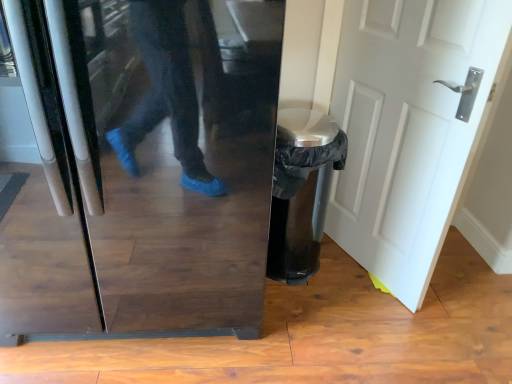
Question: Is white matte door at center taller or shorter than glossy black refrigerator at center?

Choices:
 (A) tall
 (B) short

Answer: (A)

Question: Is point (443, 220) positioned closer to the camera than point (78, 82)?

Choices:
 (A) farther
 (B) closer

Answer: (A)

Question: Considering the positions of white matte door at center and glossy black refrigerator at center in the image, is white matte door at center wider or thinner than glossy black refrigerator at center?

Choices:
 (A) wide
 (B) thin

Answer: (B)

Question: From a real-world perspective, is glossy black refrigerator at center above or below white matte door at center?

Choices:
 (A) above
 (B) below

Answer: (A)

Question: Is glossy black refrigerator at center wider or thinner than white matte door at center?

Choices:
 (A) thin
 (B) wide

Answer: (B)

Question: Considering the positions of point (233, 253) and point (432, 178), is point (233, 253) closer or farther from the camera than point (432, 178)?

Choices:
 (A) closer
 (B) farther

Answer: (A)

Question: Do you think glossy black refrigerator at center is within white matte door at center, or outside of it?

Choices:
 (A) inside
 (B) outside

Answer: (B)